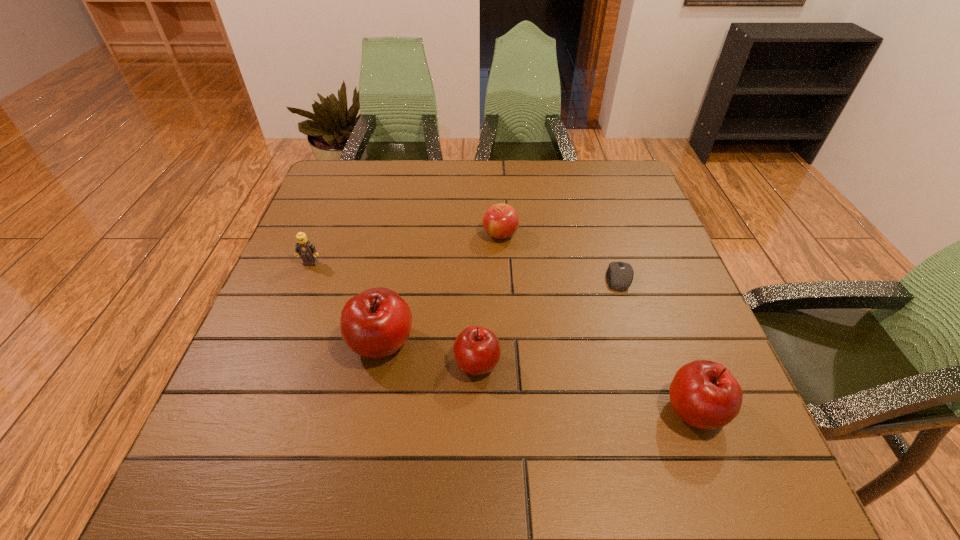
At what (x,y) coordinates should I click in order to perform the action: click on vacant space located 0.350m on the right of the second shortest apple. Please return your answer as a coordinate pair (x, y). This screenshot has height=540, width=960. Looking at the image, I should click on (678, 363).

This screenshot has width=960, height=540. What are the coordinates of `vacant space located 0.220m on the back of the rightmost apple` in the screenshot? It's located at (652, 297).

I want to click on vacant space located 0.260m on the left of the farthest object, so click(x=383, y=234).

At what (x,y) coordinates should I click in order to perform the action: click on vacant area located in front of the leftmost object. Please return your answer as a coordinate pair (x, y). This screenshot has height=540, width=960. Looking at the image, I should click on (294, 306).

Image resolution: width=960 pixels, height=540 pixels. In order to click on vacant space situated 0.380m on the back of the computer equipment in this screenshot , I will do `click(588, 179)`.

Find the location of a particular element. object located in the near edge section of the desktop is located at coordinates (704, 394).

Where is `object that is at the left edge`? object that is at the left edge is located at coordinates (306, 249).

Locate an element on the screen. This screenshot has height=540, width=960. apple present at the right edge is located at coordinates (704, 394).

Image resolution: width=960 pixels, height=540 pixels. I want to click on computer equipment that is at the right edge, so click(619, 276).

You are a GUI agent. You are given a task and a screenshot of the screen. Output one action in this format:
    pyautogui.click(x=<x>, y=<y>)
    Task: Click on the object that is at the near right corner
    The image size is (960, 540).
    Given the screenshot: What is the action you would take?
    pyautogui.click(x=704, y=394)